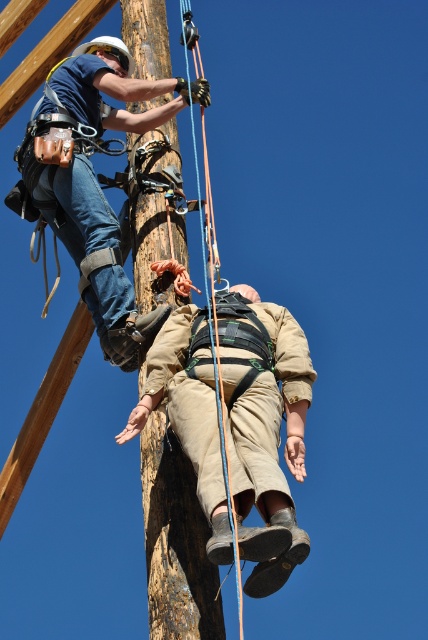
You are an observer standing at the base of the brown rough wood pole at center. Looking up, you notice the matte blue shirt at upper left. Which object appears wider from your perspective?

The matte blue shirt at upper left appears wider than the brown rough wood pole at center because its width surpasses the pole.

You are a safety inspector assessing the setup. You notice the matte blue shirt at upper left and the blue synthetic rope at center. Which object is closer to your vantage point?

The matte blue shirt at upper left is closer to the vantage point because it is positioned further to the viewer than the blue synthetic rope at center.